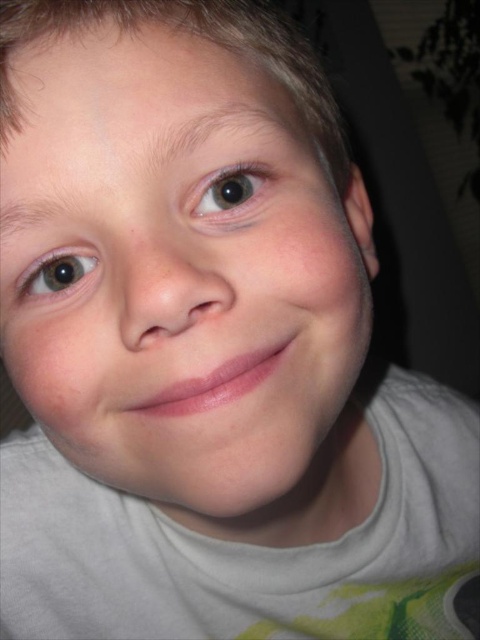
Based on the scene description, which object has a greater width when comparing the smooth skin face at center and the brown glossy eye at upper left?

The smooth skin face at center has a greater width than the brown glossy eye at upper left according to the description.

From the picture: What are the coordinates of the brown glossy eye at upper left in the image?

The coordinates of the brown glossy eye at upper left are at point (230, 192).